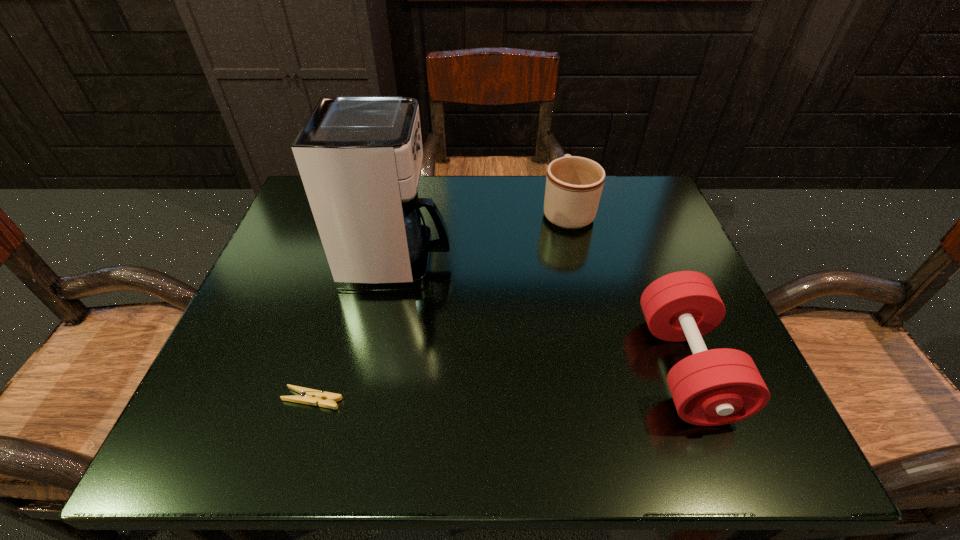
What are the coordinates of `blank area in the image that satisfies the following two spatial constraints: 1. on the front panel of the tallest object; 2. on the left side of the dumbbell` in the screenshot? It's located at (378, 367).

Locate an element on the screen. The width and height of the screenshot is (960, 540). free spot that satisfies the following two spatial constraints: 1. on the back side of the dumbbell; 2. on the front panel of the tallest object is located at coordinates coord(644,261).